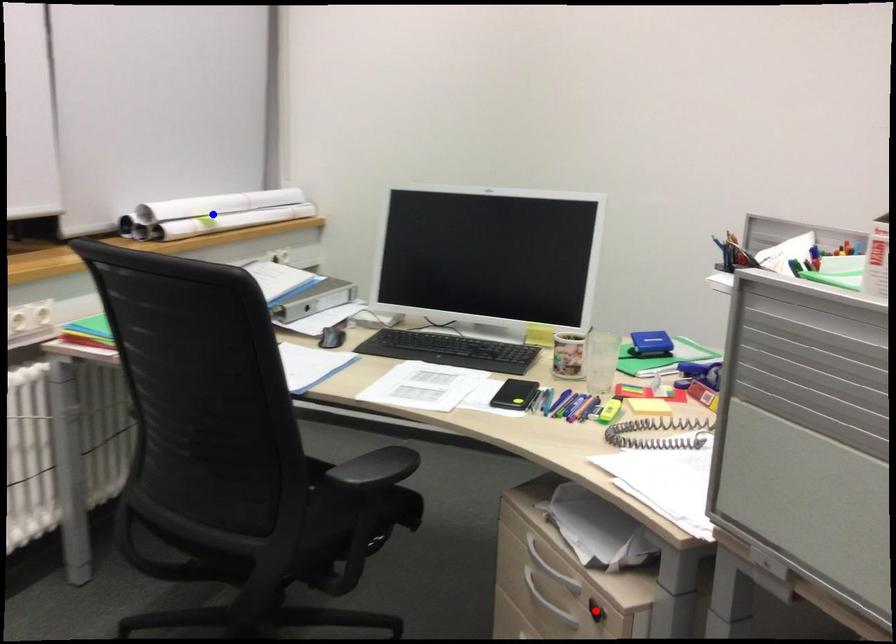
Question: In the image, two points are highlighted. Which point is nearer to the camera? Reply with the corresponding letter.

Choices:
 (A) blue point
 (B) red point

Answer: (B)